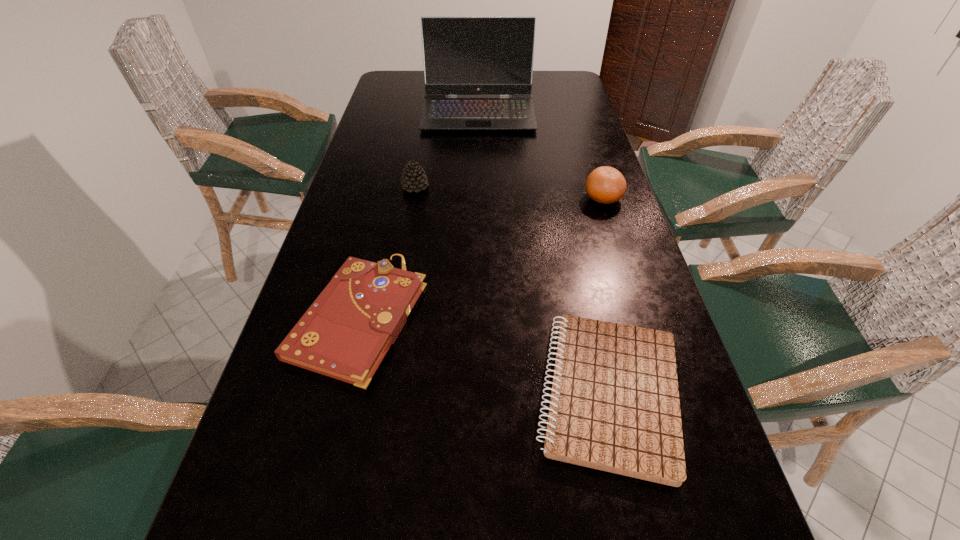
You are a GUI agent. You are given a task and a screenshot of the screen. Output one action in this format:
    pyautogui.click(x=<x>, y=<y>)
    Task: Click on the vacant space located at the narrow end of the pinecone
    
    Given the screenshot: What is the action you would take?
    pyautogui.click(x=458, y=187)

At what (x,y) coordinates should I click in order to perform the action: click on free space located on the right of the taller notebook. Please return your answer as a coordinate pair (x, y). The width and height of the screenshot is (960, 540). Looking at the image, I should click on (565, 317).

Locate an element on the screen. vacant space situated on the back of the shorter notebook is located at coordinates (574, 241).

Locate an element on the screen. This screenshot has width=960, height=540. object that is positioned at the far edge is located at coordinates (462, 55).

Find the location of `pinecone at the left edge`. pinecone at the left edge is located at coordinates (413, 178).

Where is `notebook positioned at the left edge`? The width and height of the screenshot is (960, 540). notebook positioned at the left edge is located at coordinates (345, 334).

Identify the location of clementine at the right edge. (605, 185).

This screenshot has width=960, height=540. Identify the location of notebook situated at the right edge. (614, 406).

This screenshot has height=540, width=960. In order to click on vacant space at the far edge of the desktop in this screenshot , I will do `click(534, 78)`.

Find the location of a particular element. This screenshot has height=540, width=960. free space at the left edge of the desktop is located at coordinates (277, 496).